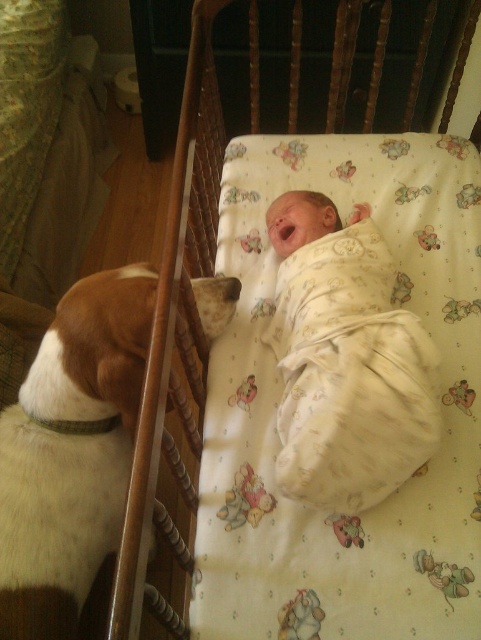
Question: Can you confirm if white soft fabric at center is thinner than white swaddled baby at center?

Choices:
 (A) yes
 (B) no

Answer: (B)

Question: Which object is positioned closest to the white soft fabric at center?

Choices:
 (A) brown and white fur at left
 (B) white swaddled baby at center

Answer: (B)

Question: Can you confirm if brown and white fur at left is thinner than white swaddled baby at center?

Choices:
 (A) yes
 (B) no

Answer: (B)

Question: Among these objects, which one is farthest from the camera?

Choices:
 (A) brown and white fur at left
 (B) white soft fabric at center
 (C) white swaddled baby at center

Answer: (C)

Question: Which of the following is the closest to the observer?

Choices:
 (A) brown and white fur at left
 (B) white swaddled baby at center

Answer: (A)

Question: Does white soft fabric at center appear on the right side of brown and white fur at left?

Choices:
 (A) no
 (B) yes

Answer: (B)